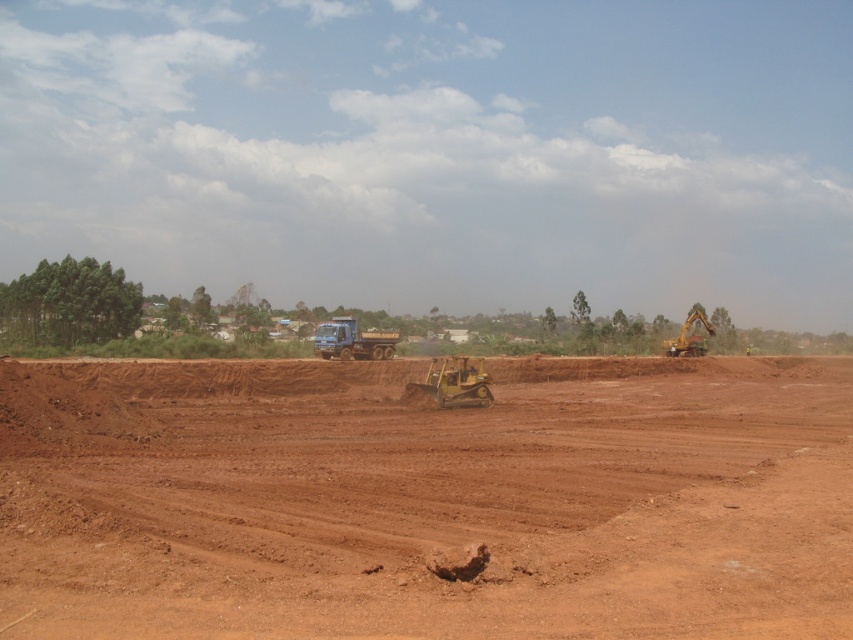
You are standing at the point marked by coordinates point (451, 381) in the image. What object are you currently standing on?

You are standing on the yellow rubber tracked vehicle at center.

You are an engineer overseeing the construction site. You notice the yellow rubber tracked vehicle at center and the yellow metallic excavator at right. Which piece of equipment is located closer to the front of the site?

The yellow rubber tracked vehicle at center is positioned under the yellow metallic excavator at right, meaning it is closer to the front of the site.

You are a construction worker standing at the edge of the brown dirt field at center. You need to walk to the blue metallic truck at center. Which direction should you walk to reach the truck?

The blue metallic truck at center is further away from you than the brown dirt field at center, so you should walk forward towards the truck.